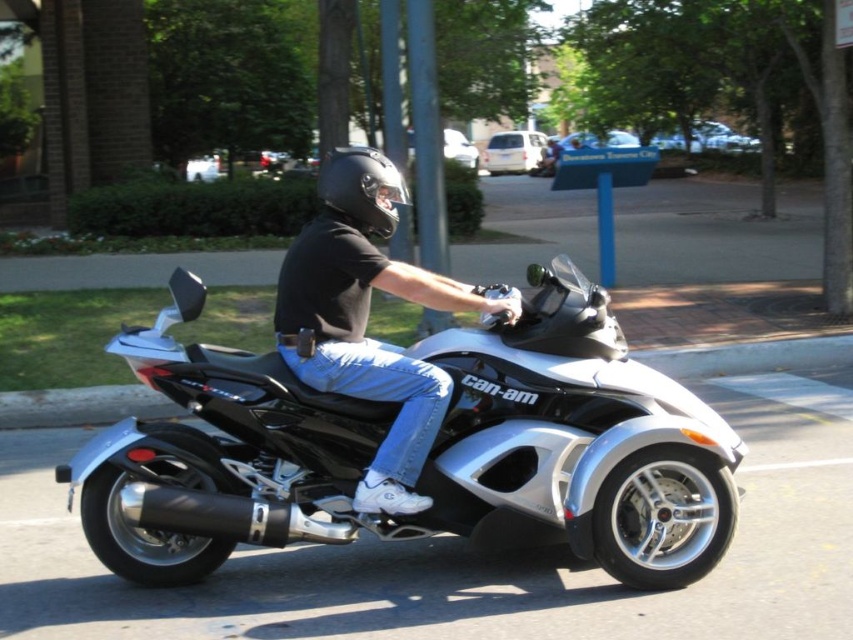
Question: Which object appears closest to the camera in this image?

Choices:
 (A) silver metallic trike at center
 (B) black matte helmet at center
 (C) matte black helmet at upper center

Answer: (A)

Question: Which object is closer to the camera taking this photo?

Choices:
 (A) silver metallic trike at center
 (B) black matte helmet at center

Answer: (A)

Question: Considering the relative positions of silver metallic trike at center and black matte helmet at center in the image provided, where is silver metallic trike at center located with respect to black matte helmet at center?

Choices:
 (A) above
 (B) below

Answer: (B)

Question: Does matte black helmet at upper center appear on the left side of black matte helmet at center?

Choices:
 (A) yes
 (B) no

Answer: (B)

Question: Among these points, which one is farthest from the camera?

Choices:
 (A) (523, 333)
 (B) (317, 237)

Answer: (A)

Question: Does matte black helmet at upper center come in front of black matte helmet at center?

Choices:
 (A) yes
 (B) no

Answer: (A)